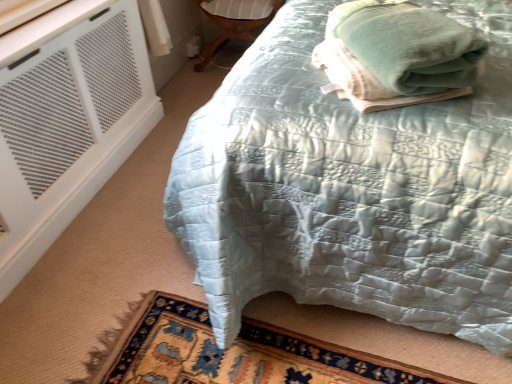
Question: Does green soft towel at upper right have a lesser height compared to matte wood side table at lower center?

Choices:
 (A) yes
 (B) no

Answer: (A)

Question: Are green soft towel at upper right and matte wood side table at lower center beside each other?

Choices:
 (A) no
 (B) yes

Answer: (A)

Question: Could you tell me if green soft towel at upper right is facing matte wood side table at lower center?

Choices:
 (A) yes
 (B) no

Answer: (B)

Question: Is green soft towel at upper right surrounding matte wood side table at lower center?

Choices:
 (A) no
 (B) yes

Answer: (A)

Question: From a real-world perspective, is green soft towel at upper right physically below matte wood side table at lower center?

Choices:
 (A) no
 (B) yes

Answer: (A)

Question: From a real-world perspective, relative to carpeted rug at lower left, is matte wood side table at lower center vertically above or below?

Choices:
 (A) above
 (B) below

Answer: (A)

Question: From the image's perspective, relative to carpeted rug at lower left, is matte wood side table at lower center above or below?

Choices:
 (A) above
 (B) below

Answer: (A)

Question: Is matte wood side table at lower center taller or shorter than carpeted rug at lower left?

Choices:
 (A) short
 (B) tall

Answer: (B)

Question: Visually, is matte wood side table at lower center positioned to the left or to the right of carpeted rug at lower left?

Choices:
 (A) right
 (B) left

Answer: (B)

Question: In the image, is green soft towel at upper right on the left side or the right side of matte wood side table at lower center?

Choices:
 (A) right
 (B) left

Answer: (A)

Question: Is green soft towel at upper right wider or thinner than matte wood side table at lower center?

Choices:
 (A) wide
 (B) thin

Answer: (B)

Question: From a real-world perspective, is green soft towel at upper right above or below matte wood side table at lower center?

Choices:
 (A) below
 (B) above

Answer: (B)

Question: Would you say green soft towel at upper right is inside or outside matte wood side table at lower center?

Choices:
 (A) outside
 (B) inside

Answer: (A)

Question: Considering the positions of white mesh air conditioning at lower left and carpeted rug at lower left in the image, is white mesh air conditioning at lower left wider or thinner than carpeted rug at lower left?

Choices:
 (A) wide
 (B) thin

Answer: (B)

Question: Choose the correct answer: Is white mesh air conditioning at lower left inside carpeted rug at lower left or outside it?

Choices:
 (A) outside
 (B) inside

Answer: (A)